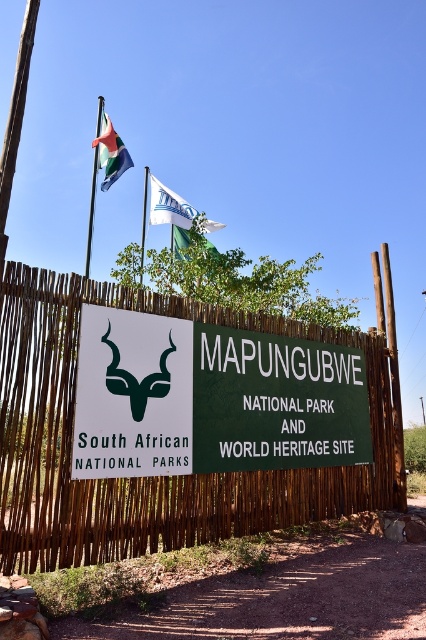
Question: Is bamboo fence at center wider than green matte sign at center?

Choices:
 (A) no
 (B) yes

Answer: (B)

Question: Among these points, which one is farthest from the camera?

Choices:
 (A) (143, 240)
 (B) (104, 140)

Answer: (A)

Question: Among these objects, which one is farthest from the camera?

Choices:
 (A) polyester flag at upper left
 (B) bamboo fence at center
 (C) white fabric flag at upper center
 (D) green fabric flag at upper center

Answer: (C)

Question: Considering the relative positions of bamboo fence at center and white fabric flag at upper center in the image provided, where is bamboo fence at center located with respect to white fabric flag at upper center?

Choices:
 (A) below
 (B) above

Answer: (A)

Question: Which is farther from the polyester flag at upper left?

Choices:
 (A) green fabric flag at upper center
 (B) bamboo fence at center
 (C) metallic flagpole at upper left

Answer: (B)

Question: Considering the relative positions of bamboo fence at center and metallic flagpole at upper left in the image provided, where is bamboo fence at center located with respect to metallic flagpole at upper left?

Choices:
 (A) above
 (B) below

Answer: (B)